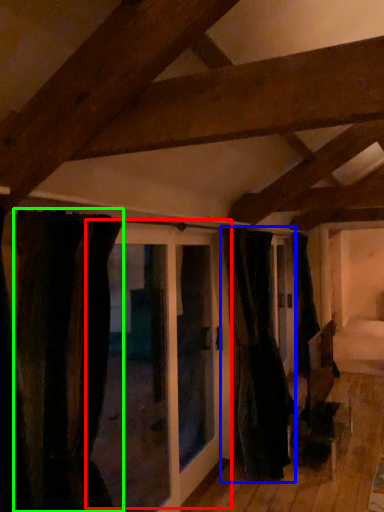
Question: Which is nearer to the door (highlighted by a red box)? curtain (highlighted by a blue box) or curtain (highlighted by a green box).

Choices:
 (A) curtain
 (B) curtain

Answer: (A)